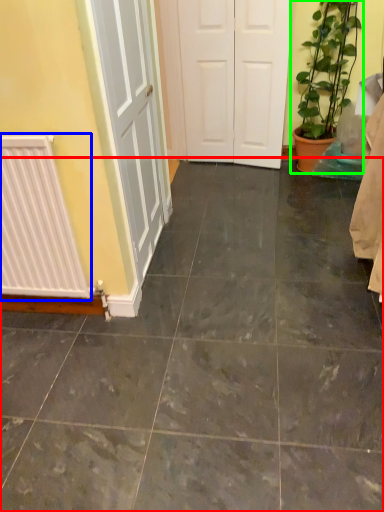
Question: Based on their relative distances, which object is farther from ceramic tile (highlighted by a red box)? Choose from radiator (highlighted by a blue box) and houseplant (highlighted by a green box).

Choices:
 (A) radiator
 (B) houseplant

Answer: (B)